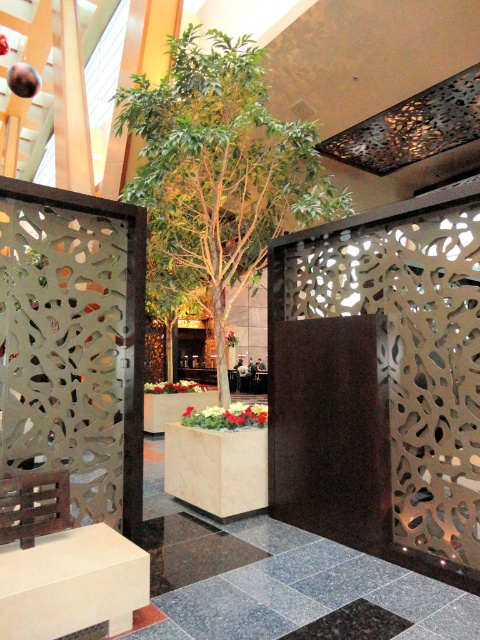
You are standing at the entrance of the indoor space and want to place a new decorative item exactly where the floral arrangement at center is currently located. According to the provided coordinates, where should you position your new item?

The floral arrangement at center is located at point (227,417), so you should position your new item at those coordinates.

You are a florist arranging flowers in the indoor space. You need to place a new floral arrangement that is 10 cm in diameter. Which object between the floral arrangement at center and the green matte planter at center can accommodate this new arrangement?

The floral arrangement at center is thinner than the green matte planter at center, so the new floral arrangement with 10 cm diameter can be placed in the green matte planter at center since it has a larger diameter.

You are standing in the indoor space described. There is a point marked at coordinates (219, 170). What object is located at that point?

The point marked at coordinates (219, 170) corresponds to the green leafy plant at center.